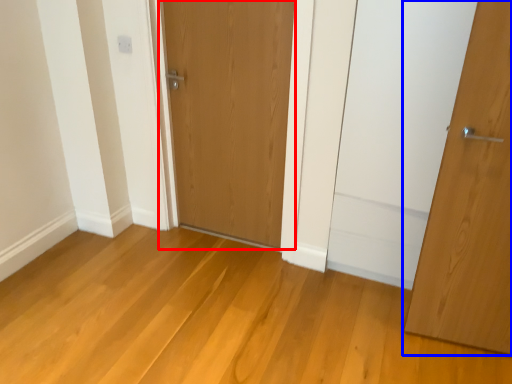
Question: Which of the following is the farthest to the observer, door (highlighted by a red box) or door (highlighted by a blue box)?

Choices:
 (A) door
 (B) door

Answer: (A)